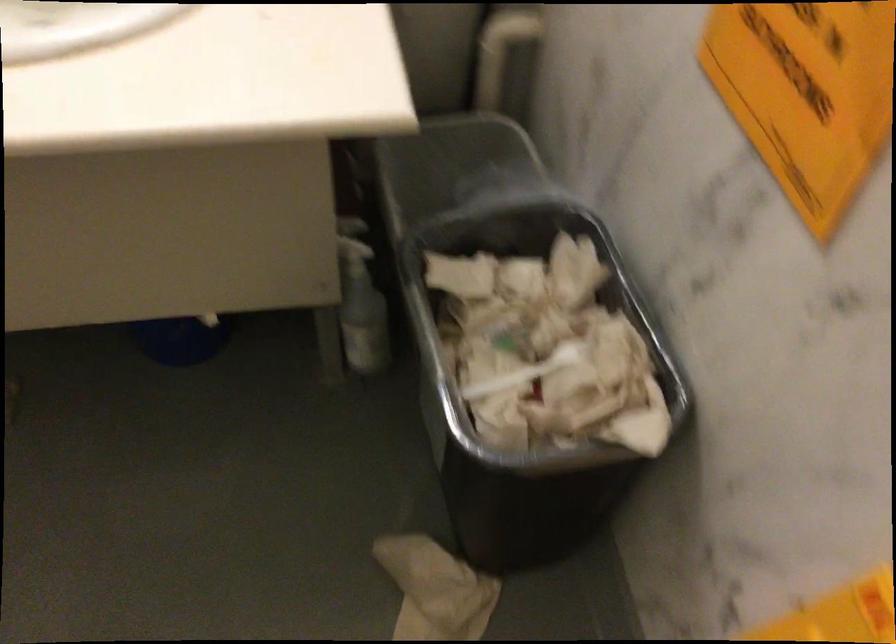
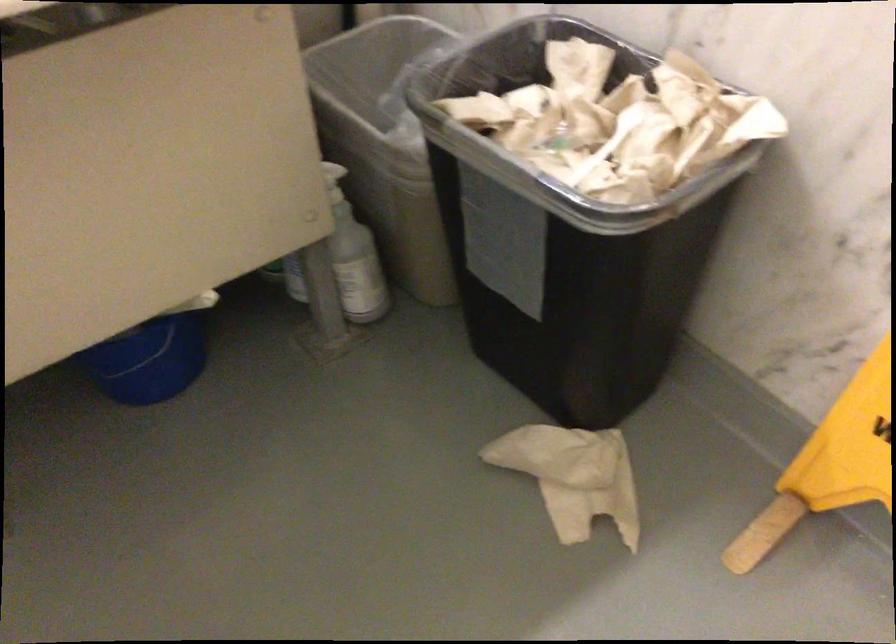
Question: The images are taken continuously from a first-person perspective. In which direction is your viewpoint rotating?

Choices:
 (A) Left
 (B) Right
 (C) Up
 (D) Down

Answer: (B)